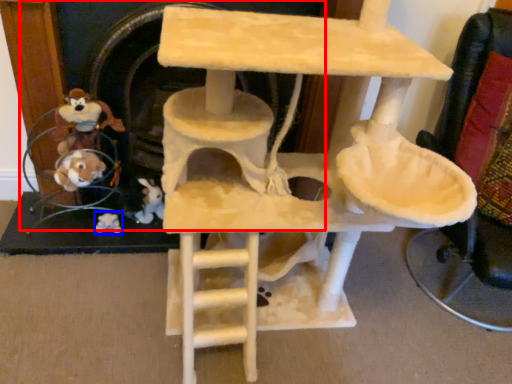
Question: Which point is closer to the camera, fireplace (highlighted by a red box) or toy (highlighted by a blue box)?

Choices:
 (A) fireplace
 (B) toy

Answer: (A)